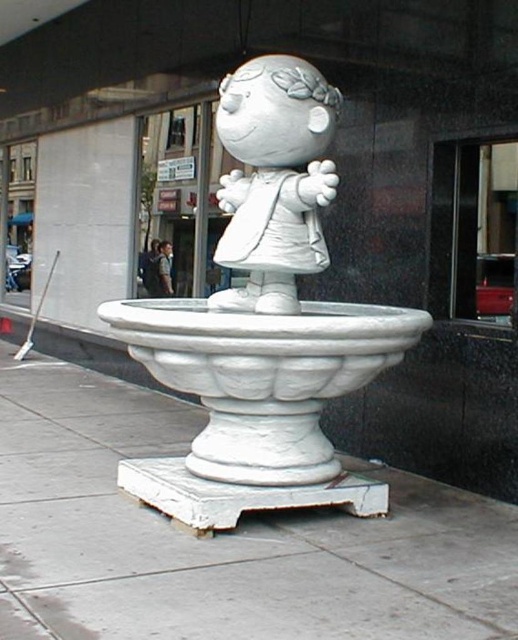
You are standing in front of the statue and want to place a small bouquet of flowers at the base. If your arm reaches 6 feet, can you place the bouquet on the white marble base at center without moving closer?

The white marble base at center is 8.24 feet away from you, which is beyond the reach of your 6 feet arm. Therefore, you cannot place the bouquet on the white marble base at center without moving closer.

You are a city planner assessing the statue placement. You need to determine if the white marble base at center can support the weight of the white matte figurine at center. What spatial relationship between them indicates this?

The white marble base at center is located below the white matte figurine at center, which means it is positioned to bear the weight of the figurine.

You are standing in front of the statue and want to place a small flower bouquet exactly where the white marble base at center is located. According to the coordinates provided, what are the coordinates where you should place the bouquet?

You should place the bouquet at coordinates point (x=221, y=538) where the white marble base at center is located.